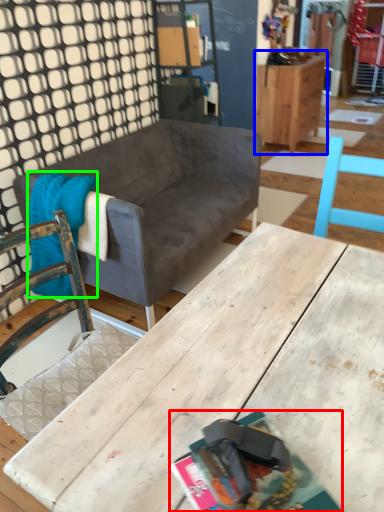
Question: Estimate the real-world distances between objects in this image. Which object is farther from magazine (highlighted by a red box), cabinetry (highlighted by a blue box) or blanket (highlighted by a green box)?

Choices:
 (A) cabinetry
 (B) blanket

Answer: (A)